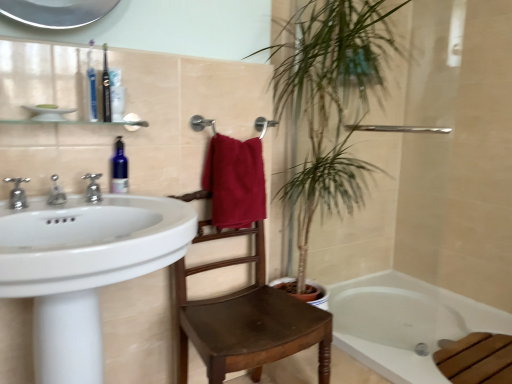
Question: Is white glossy sink at left at the back of silver metallic faucet at left, marked as the second tap in a left-to-right arrangement?

Choices:
 (A) yes
 (B) no

Answer: (B)

Question: Could you tell me if silver metallic faucet at left, marked as the second tap in a left-to-right arrangement, is facing white glossy sink at left?

Choices:
 (A) no
 (B) yes

Answer: (A)

Question: From a real-world perspective, is silver metallic faucet at left, the 2th tap in the right-to-left sequence, positioned under white glossy sink at left based on gravity?

Choices:
 (A) yes
 (B) no

Answer: (B)

Question: Does silver metallic faucet at left, marked as the second tap in a left-to-right arrangement, have a greater width compared to white glossy sink at left?

Choices:
 (A) no
 (B) yes

Answer: (A)

Question: Considering the relative sizes of silver metallic faucet at left, the 2th tap in the right-to-left sequence, and white glossy sink at left in the image provided, is silver metallic faucet at left, the 2th tap in the right-to-left sequence, shorter than white glossy sink at left?

Choices:
 (A) yes
 (B) no

Answer: (A)

Question: From a real-world perspective, is silver metallic faucet at left, marked as the second tap in a left-to-right arrangement, physically located above or below dark brown wooden chair at center?

Choices:
 (A) above
 (B) below

Answer: (A)

Question: Is silver metallic faucet at left, the 2th tap in the right-to-left sequence, situated inside dark brown wooden chair at center or outside?

Choices:
 (A) inside
 (B) outside

Answer: (B)

Question: In the image, is silver metallic faucet at left, marked as the second tap in a left-to-right arrangement, positioned in front of or behind dark brown wooden chair at center?

Choices:
 (A) front
 (B) behind

Answer: (A)

Question: In terms of height, does silver metallic faucet at left, the 2th tap in the right-to-left sequence, look taller or shorter compared to dark brown wooden chair at center?

Choices:
 (A) tall
 (B) short

Answer: (B)

Question: Looking at their shapes, would you say silver metallic faucet at left, the 2th tap in the right-to-left sequence, is wider or thinner than green leafy plant at upper center?

Choices:
 (A) thin
 (B) wide

Answer: (A)

Question: Considering the relative positions of silver metallic faucet at left, marked as the second tap in a left-to-right arrangement, and green leafy plant at upper center in the image provided, is silver metallic faucet at left, marked as the second tap in a left-to-right arrangement, to the left or to the right of green leafy plant at upper center?

Choices:
 (A) left
 (B) right

Answer: (A)

Question: From a real-world perspective, is silver metallic faucet at left, marked as the second tap in a left-to-right arrangement, positioned above or below green leafy plant at upper center?

Choices:
 (A) above
 (B) below

Answer: (A)

Question: From their relative heights in the image, would you say silver metallic faucet at left, the 2th tap in the right-to-left sequence, is taller or shorter than green leafy plant at upper center?

Choices:
 (A) short
 (B) tall

Answer: (A)

Question: From a real-world perspective, is translucent plastic toothbrush at upper left, placed as the first toiletry when sorted from back to front, positioned above or below white glossy sink at left?

Choices:
 (A) below
 (B) above

Answer: (B)

Question: From the image's perspective, is translucent plastic toothbrush at upper left, which is counted as the second toiletry, starting from the front, positioned above or below white glossy sink at left?

Choices:
 (A) below
 (B) above

Answer: (B)